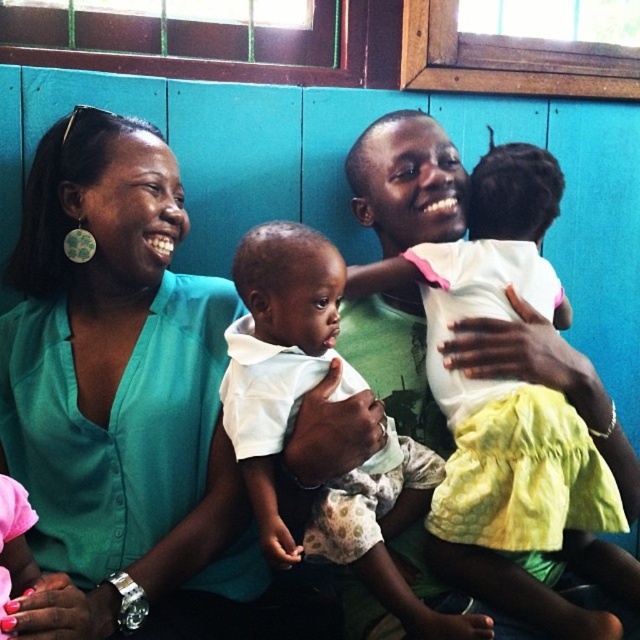
Question: Which point is closer to the camera?

Choices:
 (A) tap(264, 529)
 (B) tap(20, 291)

Answer: (A)

Question: Estimate the real-world distances between objects in this image. Which object is farther from the teal shirt at left?

Choices:
 (A) white soft fabric baby at center
 (B) white matte dress at center

Answer: (B)

Question: Which point is farther to the camera?

Choices:
 (A) white matte dress at center
 (B) teal shirt at left
 (C) white soft fabric baby at center

Answer: (A)

Question: Where is white soft fabric baby at center located in relation to white matte dress at center in the image?

Choices:
 (A) left
 (B) right

Answer: (A)

Question: Is white soft fabric baby at center wider than white matte dress at center?

Choices:
 (A) no
 (B) yes

Answer: (A)

Question: Is white soft fabric baby at center smaller than white matte dress at center?

Choices:
 (A) no
 (B) yes

Answer: (B)